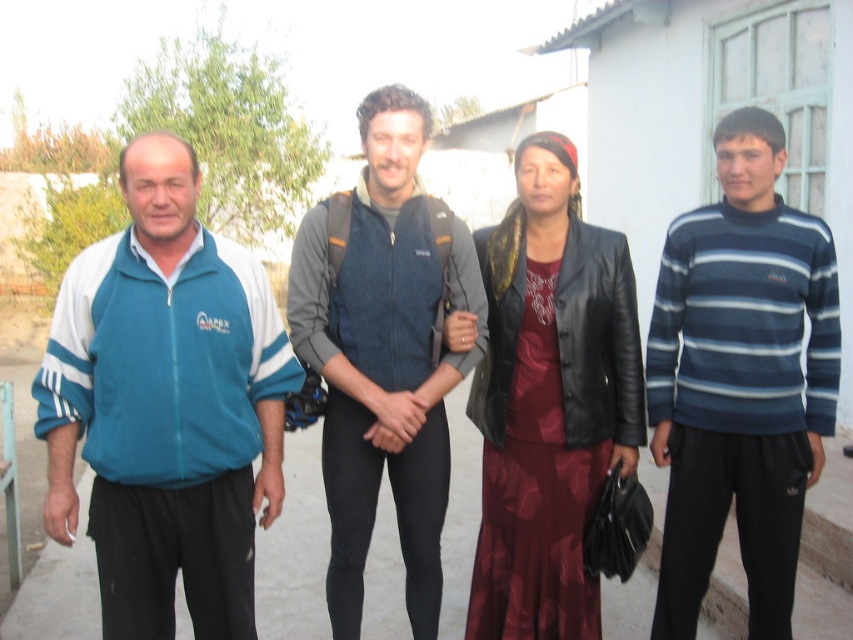
You are standing in front of the building and want to locate the blue striped sweater at right. According to the coordinates provided, where exactly is it positioned?

The blue striped sweater at right is located at point 0.594 on the x axis and 0.869 on the y axis.

You are standing at the point with coordinates point [750,186] and want to walk towards the building in the scene. Is the point [181,294] between you and the building?

Yes, the point [181,294] is between you and the building because it is in front of point [750,186], which is your current position.

You are standing in front of the building and want to hand a document to both the blue striped sweater at right and the denim jacket at center. Which person should you approach first to ensure you can reach them without moving past the other?

You should approach the blue striped sweater at right first because they are closer to you than the denim jacket at center, so you can reach them without needing to move past the other person.